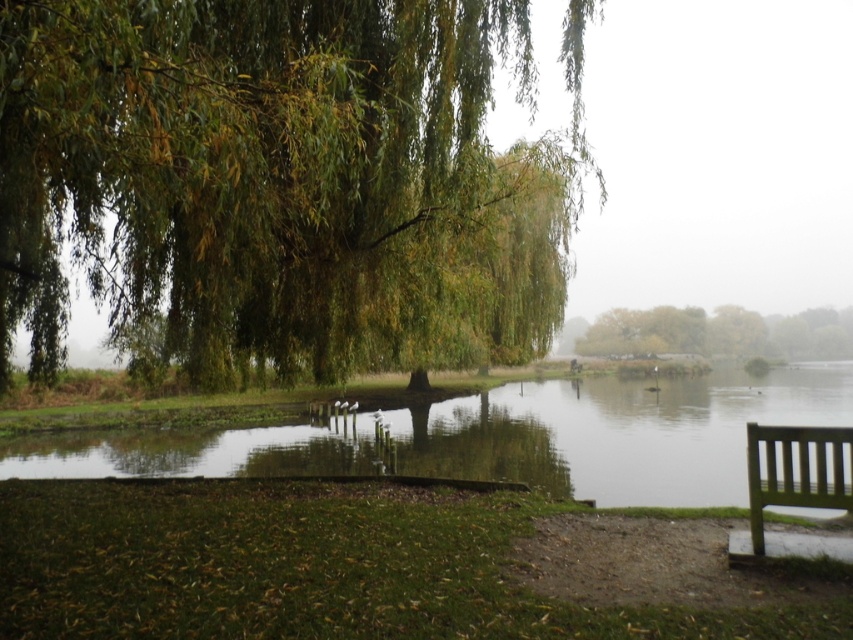
Which of these two, clear water at lower left or green leafy tree at center, stands taller?

green leafy tree at center

Does point (616, 483) lie in front of point (701, 342)?

Yes, it is.

Does point (239, 444) come in front of point (663, 316)?

Yes, point (239, 444) is in front of point (663, 316).

You are a GUI agent. You are given a task and a screenshot of the screen. Output one action in this format:
    pyautogui.click(x=<x>, y=<y>)
    Task: Click on the clear water at lower left
    
    Given the screenshot: What is the action you would take?
    pyautogui.click(x=619, y=433)

Who is shorter, green leafy willow at upper left or green leafy tree at center?

Standing shorter between the two is green leafy tree at center.

Locate an element on the screen. Image resolution: width=853 pixels, height=640 pixels. green leafy willow at upper left is located at coordinates (241, 164).

Locate an element on the screen. green leafy willow at upper left is located at coordinates (241, 164).

Who is lower down, clear water at lower left or green wooden bench at lower right?

Positioned lower is clear water at lower left.

The height and width of the screenshot is (640, 853). What do you see at coordinates (619, 433) in the screenshot?
I see `clear water at lower left` at bounding box center [619, 433].

I want to click on clear water at lower left, so click(619, 433).